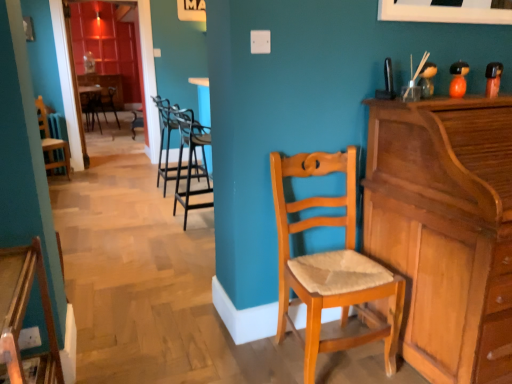
Measure the distance between wooden chair with cushion at center, positioned as the 6th chair in right-to-left order, and camera.

wooden chair with cushion at center, positioned as the 6th chair in right-to-left order, is 7.92 meters away from camera.

Where is `wooden chair at left, which appears as the 5th chair when viewed from the right`? The image size is (512, 384). wooden chair at left, which appears as the 5th chair when viewed from the right is located at coordinates click(x=51, y=140).

You are a GUI agent. You are given a task and a screenshot of the screen. Output one action in this format:
    pyautogui.click(x=<x>, y=<y>)
    Task: Click on the light brown wooden chair at center, acting as the 6th chair starting from the left
    The image size is (512, 384).
    Given the screenshot: What is the action you would take?
    pyautogui.click(x=330, y=264)

Where is `black metal barstools at center, which appears as the fourth chair when viewed from the back`? black metal barstools at center, which appears as the fourth chair when viewed from the back is located at coordinates (191, 160).

Locate an element on the screen. wooden chair with cushion at lower left, the 3th chair viewed from the right is located at coordinates (25, 311).

What is the approximate width of wooden chair with cushion at lower left, the sixth chair from the back?

wooden chair with cushion at lower left, the sixth chair from the back, is 9.05 inches in width.

What do you see at coordinates (167, 137) in the screenshot? The height and width of the screenshot is (384, 512). I see `black metal barstools at center, the fourth chair viewed from the front` at bounding box center [167, 137].

At what (x,y) coordinates should I click in order to perform the action: click on wooden chair with cushion at center, positioned as the 6th chair in right-to-left order. Please return your answer as a coordinate pair (x, y). The width and height of the screenshot is (512, 384). Looking at the image, I should click on (91, 107).

Which is more to the left, black metal barstools at center, positioned as the third chair in left-to-right order, or wooden chair at left, the second chair when ordered from back to front?

From the viewer's perspective, wooden chair at left, the second chair when ordered from back to front, appears more on the left side.

Could you tell me if black metal barstools at center, which is the third chair from back to front, is facing wooden chair at left, which is counted as the 5th chair, starting from the front?

No.

Does point (160, 113) come farther from viewer compared to point (47, 125)?

No, it is in front of (47, 125).

Between wooden chair with cushion at center, positioned as the 6th chair in right-to-left order, and black metal barstools at center, marked as the third chair in a front-to-back arrangement, which one has more height?

wooden chair with cushion at center, positioned as the 6th chair in right-to-left order, is taller.

Is wooden chair with cushion at center, positioned as the 6th chair in right-to-left order, facing away from black metal barstools at center, the 5th chair from the left?

wooden chair with cushion at center, positioned as the 6th chair in right-to-left order, does not have its back to black metal barstools at center, the 5th chair from the left.

Can you tell me how much wooden chair with cushion at center, acting as the sixth chair starting from the front, and black metal barstools at center, marked as the 2th chair in a right-to-left arrangement, differ in facing direction?

The facing directions of wooden chair with cushion at center, acting as the sixth chair starting from the front, and black metal barstools at center, marked as the 2th chair in a right-to-left arrangement, are 90 degrees apart.

This screenshot has width=512, height=384. Find the location of `chair that is the 3rd one above the black metal barstools at center, marked as the 2th chair in a right-to-left arrangement (from a real-world perspective)`. chair that is the 3rd one above the black metal barstools at center, marked as the 2th chair in a right-to-left arrangement (from a real-world perspective) is located at coordinates (91, 107).

How many degrees apart are the facing directions of light brown wooden chair at center, which is the second chair in front-to-back order, and wooden chair with cushion at center, which ranks as the 1th chair in left-to-right order?

There is a 2.71-degree angle between the facing directions of light brown wooden chair at center, which is the second chair in front-to-back order, and wooden chair with cushion at center, which ranks as the 1th chair in left-to-right order.

From a real-world perspective, between light brown wooden chair at center, which is the second chair in front-to-back order, and wooden chair with cushion at center, positioned as the 6th chair in right-to-left order, who is vertically lower?

light brown wooden chair at center, which is the second chair in front-to-back order, from a real-world perspective.

Looking at this image, would you consider light brown wooden chair at center, acting as the 6th chair starting from the left, to be distant from wooden chair with cushion at center, which ranks as the 1th chair in left-to-right order?

That's right, there is a large distance between light brown wooden chair at center, acting as the 6th chair starting from the left, and wooden chair with cushion at center, which ranks as the 1th chair in left-to-right order.

Is light brown wooden chair at center, the first chair positioned from the right, not inside wooden chair with cushion at center, which ranks as the 1th chair in left-to-right order?

Yes.

Does light brown wooden chair at center, the fifth chair positioned from the back, turn towards black metal barstools at center, marked as the 2th chair in a right-to-left arrangement?

No, light brown wooden chair at center, the fifth chair positioned from the back, is not facing towards black metal barstools at center, marked as the 2th chair in a right-to-left arrangement.

Is light brown wooden chair at center, which is the second chair in front-to-back order, in front of black metal barstools at center, marked as the third chair in a front-to-back arrangement?

Yes, it is.

From the image's perspective, does light brown wooden chair at center, the fifth chair positioned from the back, appear higher than black metal barstools at center, which appears as the fourth chair when viewed from the back?

No, from the image's perspective, light brown wooden chair at center, the fifth chair positioned from the back, is not on top of black metal barstools at center, which appears as the fourth chair when viewed from the back.

Which is correct: black metal barstools at center, which appears as the fourth chair when viewed from the back, is inside wooden chair with cushion at lower left, arranged as the first chair when viewed from the front, or outside of it?

black metal barstools at center, which appears as the fourth chair when viewed from the back, is located beyond the bounds of wooden chair with cushion at lower left, arranged as the first chair when viewed from the front.

Considering the relative positions of black metal barstools at center, marked as the third chair in a front-to-back arrangement, and wooden chair with cushion at lower left, the 3th chair viewed from the right, in the image provided, is black metal barstools at center, marked as the third chair in a front-to-back arrangement, in front of wooden chair with cushion at lower left, the 3th chair viewed from the right,?

No, black metal barstools at center, marked as the third chair in a front-to-back arrangement, is further to the viewer.

From a real-world perspective, between black metal barstools at center, marked as the 2th chair in a right-to-left arrangement, and wooden chair with cushion at lower left, the sixth chair from the back, who is vertically higher?

From a 3D spatial view, black metal barstools at center, marked as the 2th chair in a right-to-left arrangement, is above.

At what (x,y) coordinates should I click in order to perform the action: click on the 2nd chair in front of the black metal barstools at center, marked as the 2th chair in a right-to-left arrangement, starting your count from the anchor. Please return your answer as a coordinate pair (x, y). Looking at the image, I should click on (25, 311).

Does wooden chair at left, which appears as the 5th chair when viewed from the right, turn towards wooden chair with cushion at center, positioned as the 6th chair in right-to-left order?

No, wooden chair at left, which appears as the 5th chair when viewed from the right, is not oriented towards wooden chair with cushion at center, positioned as the 6th chair in right-to-left order.

Considering their positions, is wooden chair at left, which is counted as the 5th chair, starting from the front, located in front of or behind wooden chair with cushion at center, positioned as the 6th chair in right-to-left order?

Clearly, wooden chair at left, which is counted as the 5th chair, starting from the front, is in front of wooden chair with cushion at center, positioned as the 6th chair in right-to-left order.

Is wooden chair at left, placed as the second chair when sorted from left to right, spatially inside wooden chair with cushion at center, acting as the sixth chair starting from the front, or outside of it?

wooden chair at left, placed as the second chair when sorted from left to right, is not enclosed by wooden chair with cushion at center, acting as the sixth chair starting from the front.

From a real-world perspective, which object rests below the other?

In real-world perspective, wooden chair with cushion at lower left, the 3th chair viewed from the right, is lower.

Is wooden chair with cushion at center, which ranks as the 1th chair in left-to-right order, turned away from wooden chair with cushion at lower left, arranged as the first chair when viewed from the front?

No, wooden chair with cushion at lower left, arranged as the first chair when viewed from the front, is not at the back of wooden chair with cushion at center, which ranks as the 1th chair in left-to-right order.

Can you confirm if wooden chair with cushion at center, which ranks as the 1th chair in left-to-right order, is wider than wooden chair with cushion at lower left, the sixth chair from the back?

Correct, the width of wooden chair with cushion at center, which ranks as the 1th chair in left-to-right order, exceeds that of wooden chair with cushion at lower left, the sixth chair from the back.

Can you confirm if wooden chair with cushion at center, which is counted as the 1th chair, starting from the back, is shorter than wooden chair with cushion at lower left, the 3th chair viewed from the right?

No.

From a real-world perspective, starting from the wooden chair at left, which is counted as the 5th chair, starting from the front, which chair is the 1st one vertically above it? Please provide its 2D coordinates.

[(167, 137)]

There is a wooden chair with cushion at center, which ranks as the 1th chair in left-to-right order. Identify the location of the 3rd chair below it (from the image's perspective). Image resolution: width=512 pixels, height=384 pixels. (191, 160).

From the image, which object appears to be farther from black metal barstools at center, acting as the fourth chair starting from the right, wooden chair with cushion at lower left, the 3th chair viewed from the right, or wooden chair at left, placed as the second chair when sorted from left to right?

The object further to black metal barstools at center, acting as the fourth chair starting from the right, is wooden chair with cushion at lower left, the 3th chair viewed from the right.

Looking at this image, from the image, which object appears to be nearer to wooden chair with cushion at center, which is counted as the 1th chair, starting from the back, light brown wood piano at right or wooden chair with cushion at lower left, positioned as the fourth chair in left-to-right order?

wooden chair with cushion at lower left, positioned as the fourth chair in left-to-right order, lies closer to wooden chair with cushion at center, which is counted as the 1th chair, starting from the back, than the other object.

Estimate the real-world distances between objects in this image. Which object is further from light brown wooden chair at center, the first chair positioned from the right, black metal barstools at center, which is the third chair from back to front, or black metal barstools at center, marked as the 2th chair in a right-to-left arrangement?

black metal barstools at center, which is the third chair from back to front.

Consider the image. Based on their spatial positions, is wooden chair with cushion at center, which ranks as the 1th chair in left-to-right order, or black metal barstools at center, which appears as the fourth chair when viewed from the back, further from light brown wooden chair at center, the first chair positioned from the right?

Based on the image, wooden chair with cushion at center, which ranks as the 1th chair in left-to-right order, appears to be further to light brown wooden chair at center, the first chair positioned from the right.

When comparing their distances from black metal barstools at center, the fourth chair viewed from the front, does light brown wood piano at right or wooden chair with cushion at lower left, arranged as the first chair when viewed from the front, seem closer?

Based on the image, wooden chair with cushion at lower left, arranged as the first chair when viewed from the front, appears to be nearer to black metal barstools at center, the fourth chair viewed from the front.

Consider the image. Looking at the image, which one is located further to wooden chair with cushion at center, positioned as the 6th chair in right-to-left order, black metal barstools at center, which is the third chair from back to front, or light brown wood piano at right?

light brown wood piano at right.

Looking at the image, which one is located further to black metal barstools at center, acting as the fourth chair starting from the right, light brown wood piano at right or light brown wooden chair at center, which is the second chair in front-to-back order?

Based on the image, light brown wood piano at right appears to be further to black metal barstools at center, acting as the fourth chair starting from the right.

When comparing their distances from light brown wood piano at right, does light brown wooden chair at center, which is the second chair in front-to-back order, or wooden chair with cushion at center, which is counted as the 1th chair, starting from the back, seem closer?

light brown wooden chair at center, which is the second chair in front-to-back order.

This screenshot has height=384, width=512. Identify the location of chair between wooden chair with cushion at lower left, the sixth chair from the back, and black metal barstools at center, the 5th chair from the left, along the z-axis. (330, 264).

The height and width of the screenshot is (384, 512). In order to click on cabinetry between wooden chair with cushion at lower left, the 3th chair viewed from the right, and black metal barstools at center, positioned as the third chair in left-to-right order, in the front-back direction in this screenshot , I will do `click(445, 230)`.

This screenshot has height=384, width=512. I want to click on chair between light brown wood piano at right and black metal barstools at center, marked as the third chair in a front-to-back arrangement, along the z-axis, so 330,264.

Image resolution: width=512 pixels, height=384 pixels. What are the coordinates of `cabinetry between wooden chair with cushion at lower left, the sixth chair from the back, and wooden chair with cushion at center, acting as the sixth chair starting from the front, from front to back` in the screenshot? It's located at (445, 230).